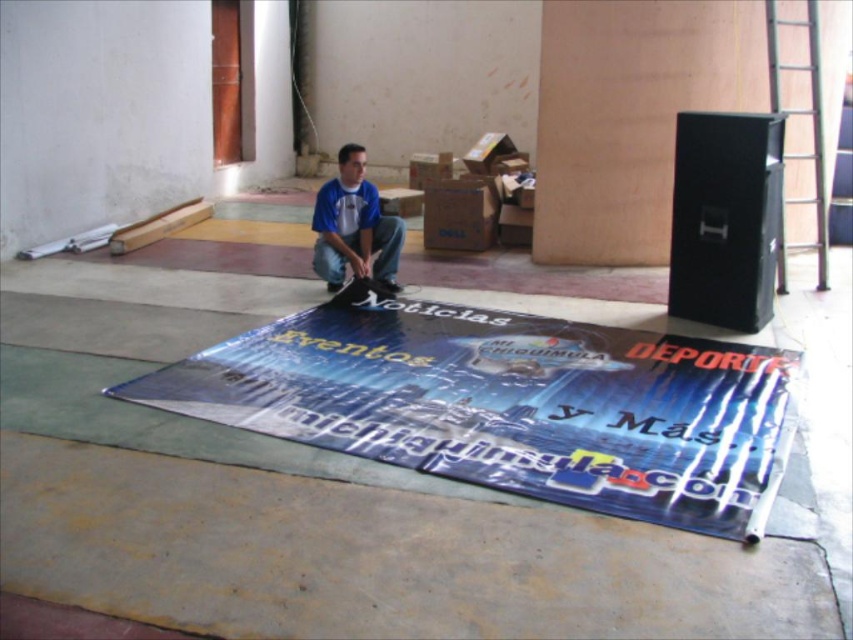
You are standing in the room where the man is working on the banner. The speaker is at point (724, 218). If you want to move the speaker to the center of the banner, which direction should you move it? Please answer with either left, right, up, or down.

The point (724, 218) is at the upper right, so to move the speaker to the center of the banner, you would need to move it down and to the left.

Where is the shiny plastic poster at center located in the image?

The shiny plastic poster at center is located at point (511,404) in the image.